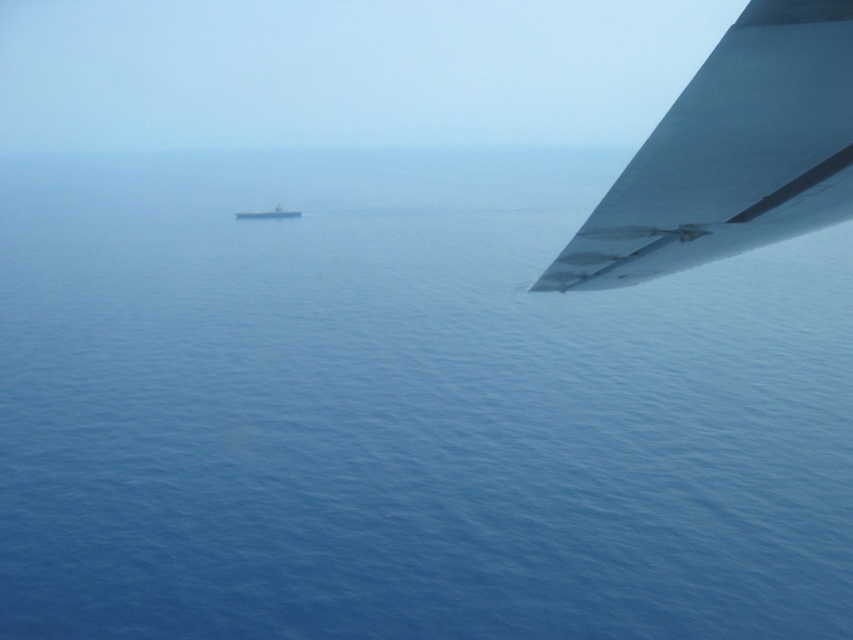
In the scene shown: You are a pilot flying a plane and you notice two objects in the distance. You see the metallic gray winglet at upper right and the gray metallic boat at center. Which object appears smaller from your current viewpoint?

The metallic gray winglet at upper right appears smaller compared to the gray metallic boat at center because it is described as having a smaller size.

You are a pilot flying a plane with a wingspan of 495 meters. You spot a metallic gray winglet at upper right and a gray metallic boat at center in the distance. Can your plane safely pass between them without touching either?

The metallic gray winglet at upper right and the gray metallic boat at center are 494.84 meters apart. Since your plane has a wingspan of 495 meters, it is slightly wider than the distance between them, so passing between them would not be safe as the wings would likely touch both objects.

You are standing on a boat in the middle of the ocean and see two points marked in the image. Which point, point (775, 177) or point (281, 211), is closer to your current position?

Point (775, 177) is closer to the camera than point (281, 211), so the point closer to your current position is point (775, 177).